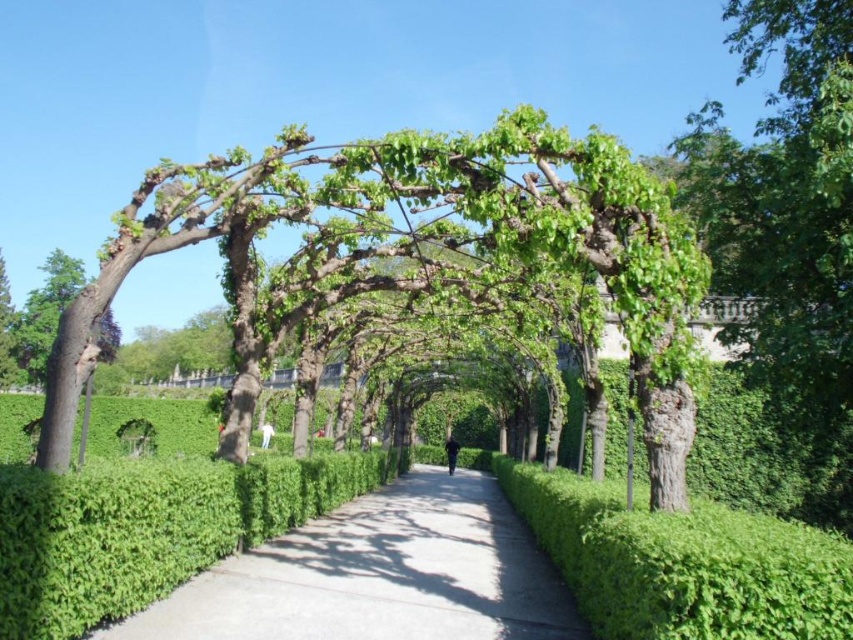
Question: Which point is farther to the camera?

Choices:
 (A) smooth brown tree trunk at left
 (B) green leafy tree at center
 (C) green concrete pavement at center

Answer: (A)

Question: Which of the following is the closest to the observer?

Choices:
 (A) (22, 364)
 (B) (450, 234)

Answer: (B)

Question: Can you confirm if green leafy tree at center is positioned to the left of smooth brown tree trunk at left?

Choices:
 (A) yes
 (B) no

Answer: (B)

Question: Is the position of green leafy tree at center less distant than that of smooth brown tree trunk at left?

Choices:
 (A) yes
 (B) no

Answer: (A)

Question: Which of these objects is positioned farthest from the green leafy tree at center?

Choices:
 (A) green concrete pavement at center
 (B) smooth brown tree trunk at left

Answer: (B)

Question: Can you confirm if green leafy tree at center is wider than green concrete pavement at center?

Choices:
 (A) no
 (B) yes

Answer: (B)